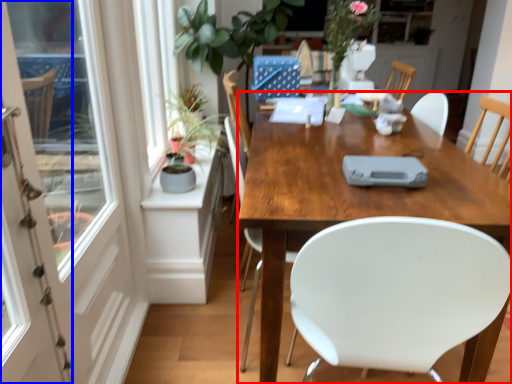
Question: Which object appears closest to the camera in this image, desk (highlighted by a red box) or screen door (highlighted by a blue box)?

Choices:
 (A) desk
 (B) screen door

Answer: (B)